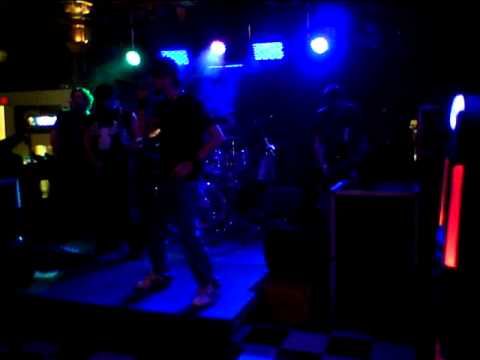
You are a GUI agent. You are given a task and a screenshot of the screen. Output one action in this format:
    pyautogui.click(x=<x>, y=<y>)
    Task: Click on the spot light
    This screenshot has width=480, height=360.
    Given the screenshot: What is the action you would take?
    pyautogui.click(x=318, y=44), pyautogui.click(x=220, y=49), pyautogui.click(x=141, y=56)